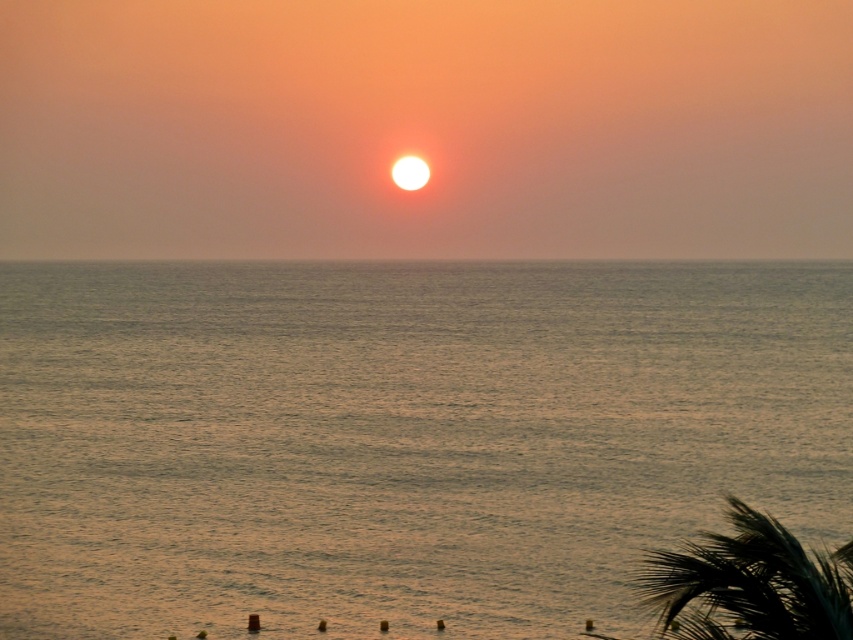
Question: Does silvery water at center lie in front of dark green leafy palm tree at lower right?

Choices:
 (A) yes
 (B) no

Answer: (B)

Question: Which point is farther from the camera taking this photo?

Choices:
 (A) (666, 570)
 (B) (547, 282)

Answer: (B)

Question: Is silvery water at center to the right of dark green leafy palm tree at lower right from the viewer's perspective?

Choices:
 (A) yes
 (B) no

Answer: (B)

Question: Is silvery water at center to the right of dark green leafy palm tree at lower right from the viewer's perspective?

Choices:
 (A) no
 (B) yes

Answer: (A)